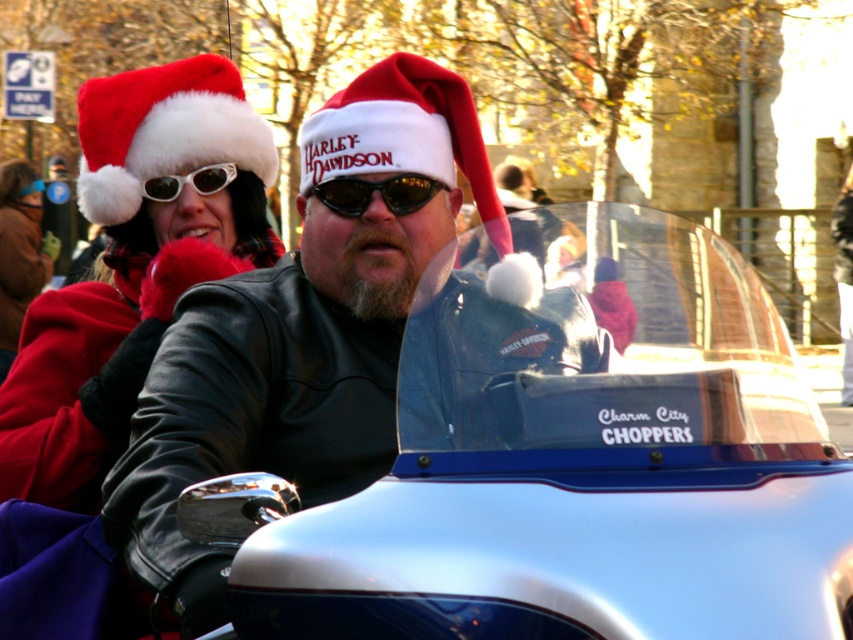
Question: Estimate the real-world distances between objects in this image. Which object is farther from the matte black sunglasses at upper center?

Choices:
 (A) leather jacket at center
 (B) black plastic sunglasses at center
 (C) fuzzy red santa hat at upper left

Answer: (A)

Question: Does metallic blue motorcycle at center have a greater width compared to leather jacket at center?

Choices:
 (A) yes
 (B) no

Answer: (A)

Question: Is metallic blue motorcycle at center bigger than fuzzy red santa hat at upper left?

Choices:
 (A) no
 (B) yes

Answer: (B)

Question: Which point is closer to the camera taking this photo?

Choices:
 (A) (329, 566)
 (B) (527, 262)
 (C) (234, 172)
 (D) (260, 129)

Answer: (A)

Question: Is metallic blue motorcycle at center bigger than fuzzy red santa hat at upper left?

Choices:
 (A) no
 (B) yes

Answer: (B)

Question: Among these objects, which one is nearest to the camera?

Choices:
 (A) black plastic sunglasses at center
 (B) fuzzy red santa hat at upper left
 (C) matte black sunglasses at upper center

Answer: (B)